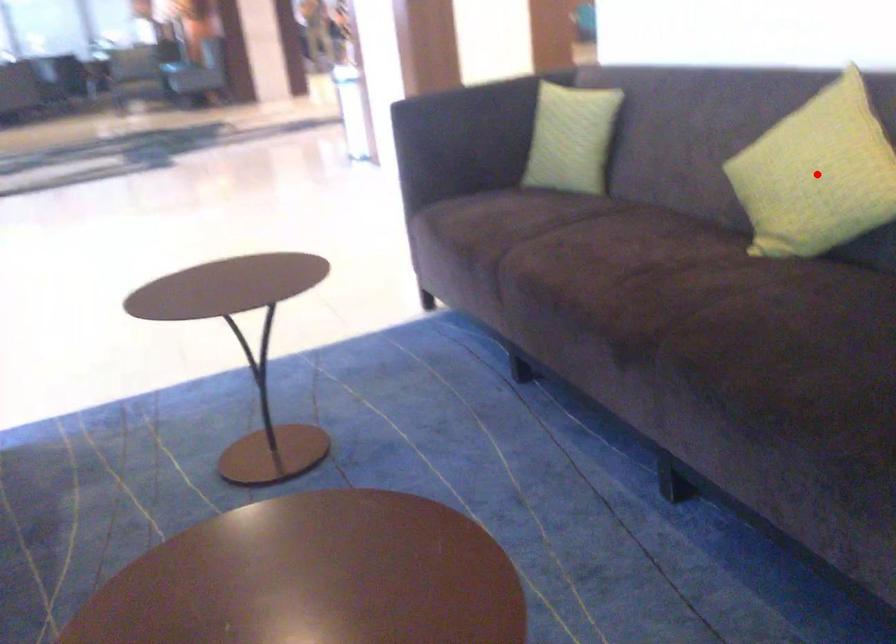
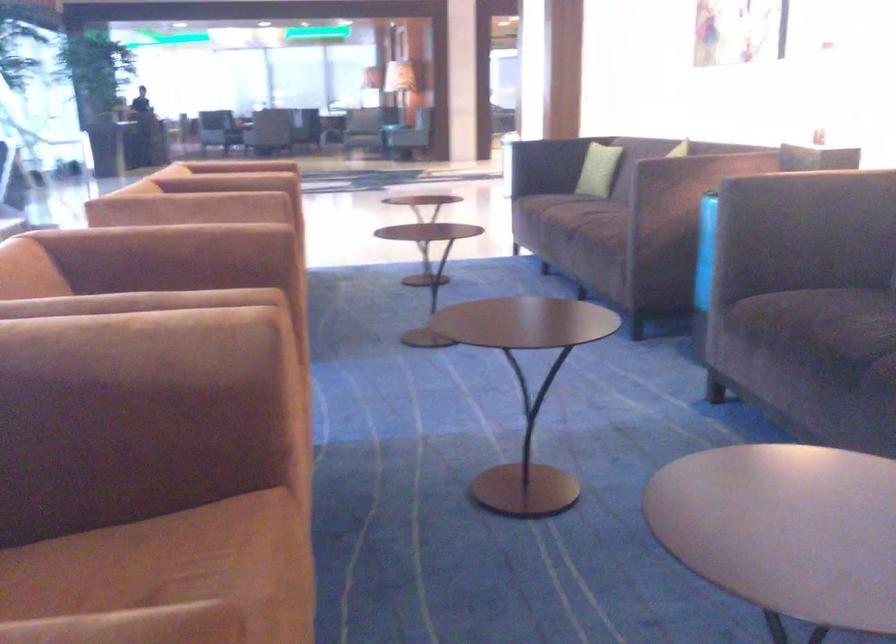
Question: I am providing you with two images of the same scene from different viewpoints. A red point is marked on the first image. Can you still see the location of the red point in image 2?

Choices:
 (A) Yes
 (B) No

Answer: (B)